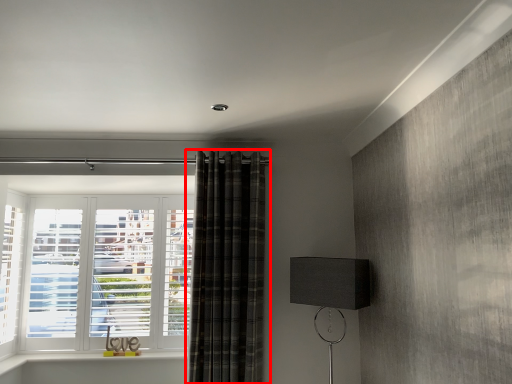
Question: Where is curtain (annotated by the red box) located in relation to table lamp in the image?

Choices:
 (A) left
 (B) right

Answer: (A)